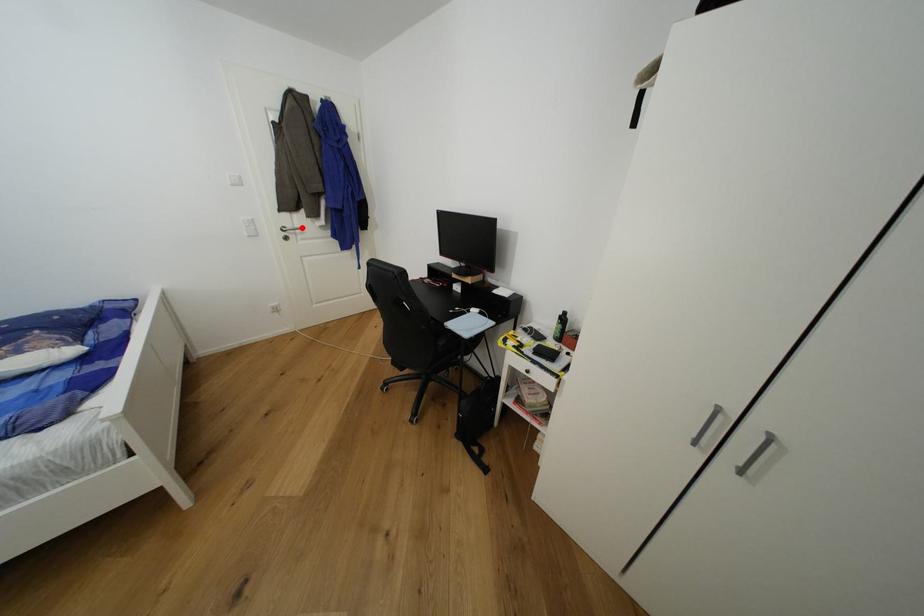
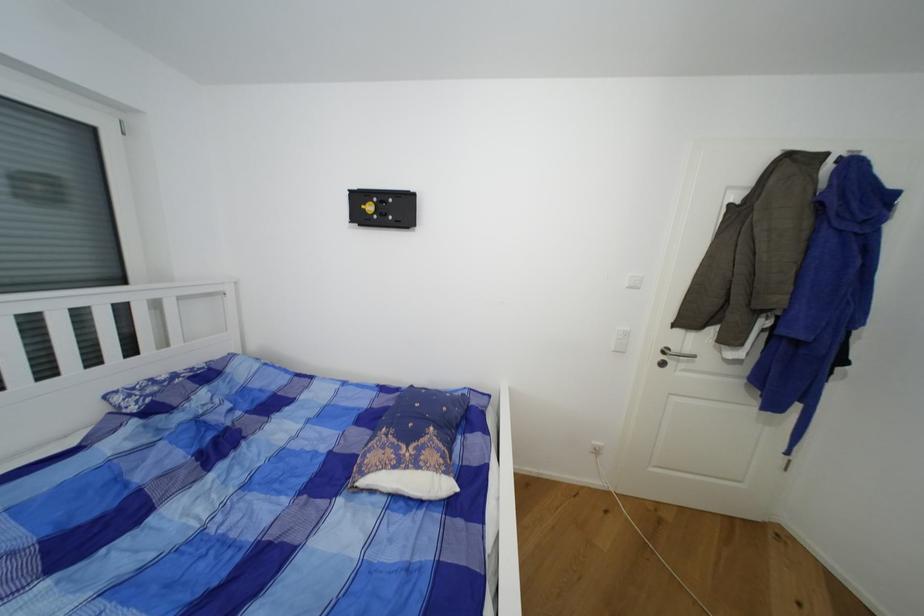
Question: A red point is marked in image1. In image2, is the corresponding 3D point closer to the camera or farther? Reply with the corresponding letter.

Choices:
 (A) The corresponding 3D point is closer.
 (B) The corresponding 3D point is farther.

Answer: (B)